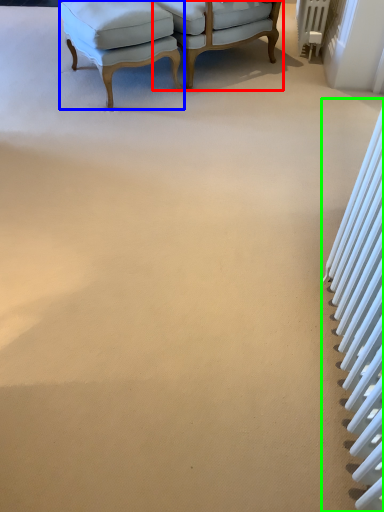
Question: Which is farther away from chair (highlighted by a red box)? chair (highlighted by a blue box) or radiator (highlighted by a green box)?

Choices:
 (A) chair
 (B) radiator

Answer: (B)